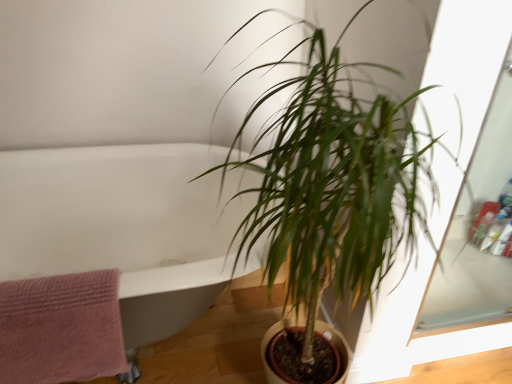
Describe the element at coordinates (61, 328) in the screenshot. Image resolution: width=512 pixels, height=384 pixels. I see `pink textured towel at left` at that location.

Describe the element at coordinates (124, 226) in the screenshot. I see `white glossy bathtub at upper left` at that location.

Measure the distance between white glossy bathtub at upper left and camera.

The distance of white glossy bathtub at upper left from camera is 36.37 inches.

The height and width of the screenshot is (384, 512). What do you see at coordinates (334, 182) in the screenshot?
I see `green leafy plant at center` at bounding box center [334, 182].

Locate an element on the screen. Image resolution: width=512 pixels, height=384 pixels. pink textured towel at left is located at coordinates (61, 328).

Find the location of a particular element. bath towel below the green leafy plant at center (from the image's perspective) is located at coordinates (61, 328).

Is pink textured towel at left in contact with green leafy plant at center?

pink textured towel at left and green leafy plant at center are clearly separated.

Which is closer to the camera, [105,302] or [402,167]?

Point [105,302] appears to be farther away from the viewer than point [402,167].

Is pink textured towel at left inside or outside of green leafy plant at center?

pink textured towel at left is spatially situated outside green leafy plant at center.

Image resolution: width=512 pixels, height=384 pixels. What are the coordinates of `houseplant that is above the white glossy bathtub at upper left (from a real-world perspective)` in the screenshot? It's located at (334, 182).

Who is shorter, white glossy bathtub at upper left or green leafy plant at center?

white glossy bathtub at upper left.

Which point is more forward, (149, 309) or (281, 172)?

Point (149, 309)

Where is `bath towel located on the left of green leafy plant at center`? This screenshot has width=512, height=384. bath towel located on the left of green leafy plant at center is located at coordinates (61, 328).

Looking at the image, does green leafy plant at center seem bigger or smaller compared to pink textured towel at left?

Considering their sizes, green leafy plant at center takes up more space than pink textured towel at left.

Is green leafy plant at center further to camera compared to pink textured towel at left?

No, green leafy plant at center is closer to the viewer.

In the scene shown: How far apart are green leafy plant at center and pink textured towel at left?

green leafy plant at center is 51.85 centimeters away from pink textured towel at left.

From a real-world perspective, is pink textured towel at left physically above white glossy bathtub at upper left?

Correct, in the physical world, pink textured towel at left is higher than white glossy bathtub at upper left.

How much distance is there between pink textured towel at left and white glossy bathtub at upper left?

pink textured towel at left and white glossy bathtub at upper left are 13.25 inches apart from each other.

Does pink textured towel at left have a lesser width compared to white glossy bathtub at upper left?

Yes, pink textured towel at left is thinner than white glossy bathtub at upper left.

Is pink textured towel at left located outside white glossy bathtub at upper left?

That's incorrect, pink textured towel at left is not completely outside white glossy bathtub at upper left.

Can you confirm if white glossy bathtub at upper left is smaller than pink textured towel at left?

Incorrect, white glossy bathtub at upper left is not smaller in size than pink textured towel at left.

Is white glossy bathtub at upper left aimed at pink textured towel at left?

Yes.

Is white glossy bathtub at upper left not within pink textured towel at left?

Yes.

From a real-world perspective, who is located lower, white glossy bathtub at upper left or pink textured towel at left?

white glossy bathtub at upper left.

In the image, is green leafy plant at center positioned in front of or behind white glossy bathtub at upper left?

Visually, green leafy plant at center is located in front of white glossy bathtub at upper left.

Would you say green leafy plant at center is a long distance from white glossy bathtub at upper left?

They are positioned close to each other.

Consider the image. Can you confirm if green leafy plant at center is thinner than white glossy bathtub at upper left?

Indeed, green leafy plant at center has a lesser width compared to white glossy bathtub at upper left.

You are a GUI agent. You are given a task and a screenshot of the screen. Output one action in this format:
    pyautogui.click(x=<x>, y=<y>)
    Task: Click on the bath towel that is below the green leafy plant at center (from the image's perspective)
    The image size is (512, 384).
    Given the screenshot: What is the action you would take?
    pyautogui.click(x=61, y=328)

The image size is (512, 384). I want to click on houseplant lying above the white glossy bathtub at upper left (from the image's perspective), so click(334, 182).

From the image, which object appears to be farther from pink textured towel at left, green leafy plant at center or white glossy bathtub at upper left?

green leafy plant at center is positioned further to the anchor pink textured towel at left.

Based on the photo, estimate the real-world distances between objects in this image. Which object is closer to green leafy plant at center, white glossy bathtub at upper left or pink textured towel at left?

Among the two, white glossy bathtub at upper left is located nearer to green leafy plant at center.

Looking at the image, which one is located closer to white glossy bathtub at upper left, green leafy plant at center or pink textured towel at left?

Based on the image, pink textured towel at left appears to be nearer to white glossy bathtub at upper left.

In the scene shown: From the image, which object appears to be farther from white glossy bathtub at upper left, pink textured towel at left or green leafy plant at center?

green leafy plant at center is positioned further to the anchor white glossy bathtub at upper left.

Estimate the real-world distances between objects in this image. Which object is further from green leafy plant at center, pink textured towel at left or white glossy bathtub at upper left?

pink textured towel at left lies further to green leafy plant at center than the other object.

Based on their spatial positions, is white glossy bathtub at upper left or green leafy plant at center closer to pink textured towel at left?

white glossy bathtub at upper left.

Where is `bath between pink textured towel at left and green leafy plant at center`? Image resolution: width=512 pixels, height=384 pixels. bath between pink textured towel at left and green leafy plant at center is located at coordinates (124, 226).